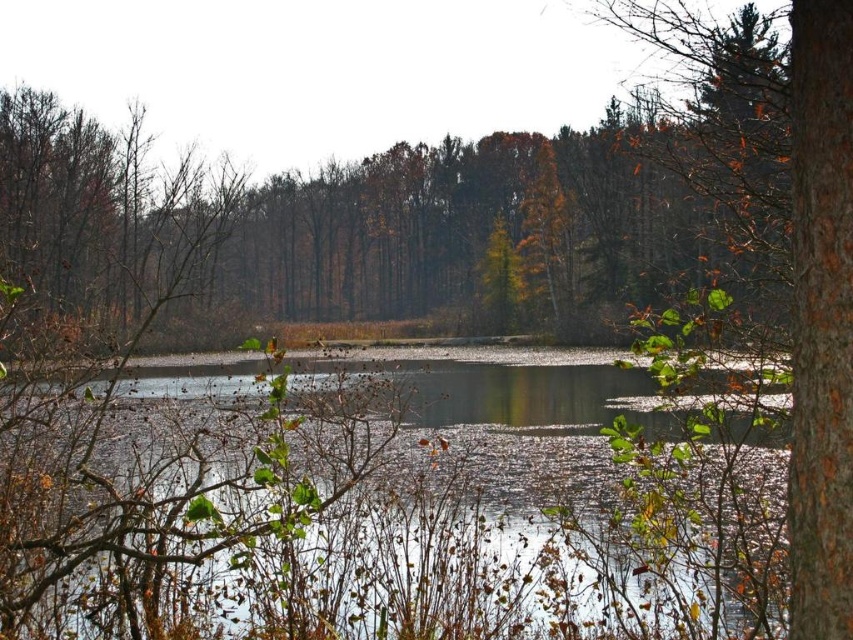
Is clear water at center thinner than brown rough bark tree at right?

No, clear water at center is not thinner than brown rough bark tree at right.

Can you confirm if clear water at center is positioned to the right of brown rough bark tree at right?

No, clear water at center is not to the right of brown rough bark tree at right.

Which is behind, point (314, 396) or point (836, 564)?

The point (314, 396) is behind.

Where is `clear water at center`? Image resolution: width=853 pixels, height=640 pixels. clear water at center is located at coordinates click(370, 515).